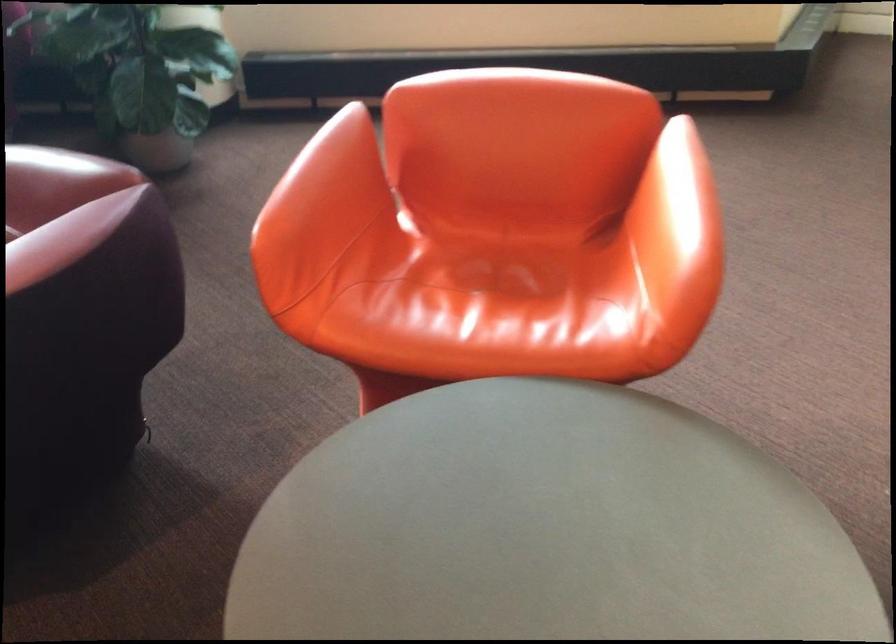
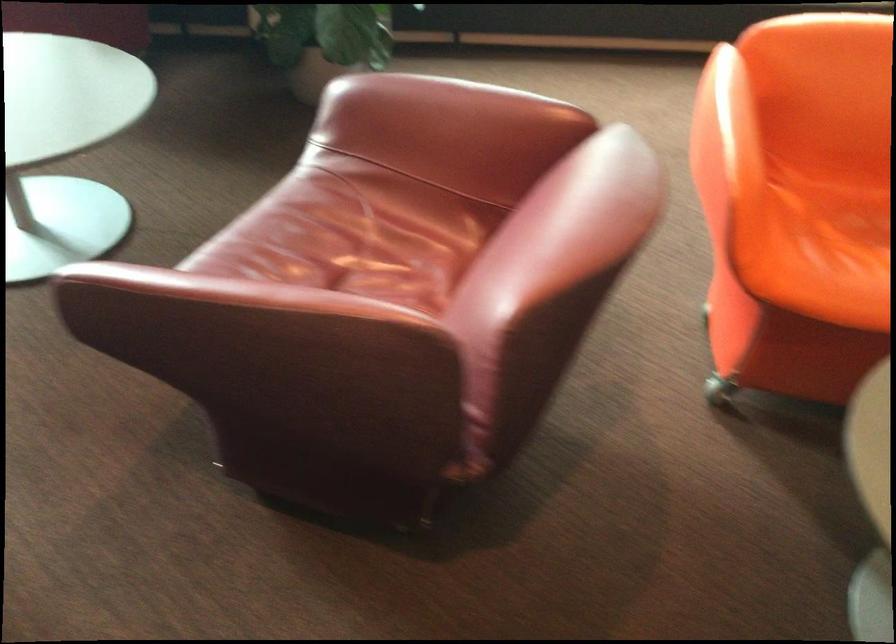
Where in the second image is the point corresponding to (x=321, y=192) from the first image?

(762, 135)